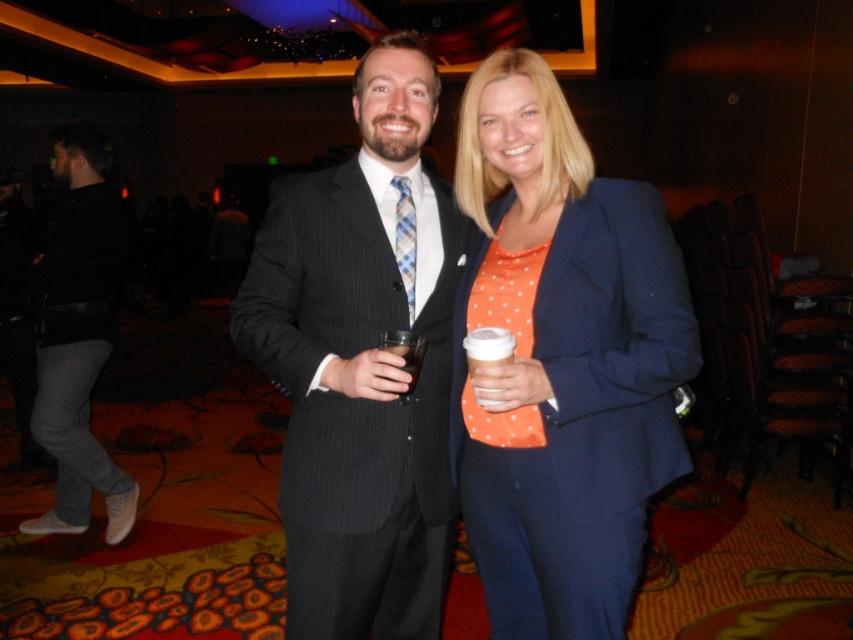
Question: Estimate the real-world distances between objects in this image. Which object is farther from the dark gray jeans at left?

Choices:
 (A) blue fabric jacket at center
 (B) matte black suit at center

Answer: (A)

Question: Is blue fabric jacket at center to the left of white paper cup at center from the viewer's perspective?

Choices:
 (A) no
 (B) yes

Answer: (A)

Question: Among these objects, which one is farthest from the camera?

Choices:
 (A) blue fabric jacket at center
 (B) dark gray jeans at left
 (C) white paper cup at center
 (D) matte black suit at center

Answer: (B)

Question: Which point is closer to the camera?

Choices:
 (A) matte plastic cup at center
 (B) dark gray jeans at left
 (C) blue fabric jacket at center

Answer: (C)

Question: Does matte black suit at center appear over white paper cup at center?

Choices:
 (A) yes
 (B) no

Answer: (A)

Question: Does blue fabric jacket at center lie behind white paper cup at center?

Choices:
 (A) yes
 (B) no

Answer: (A)